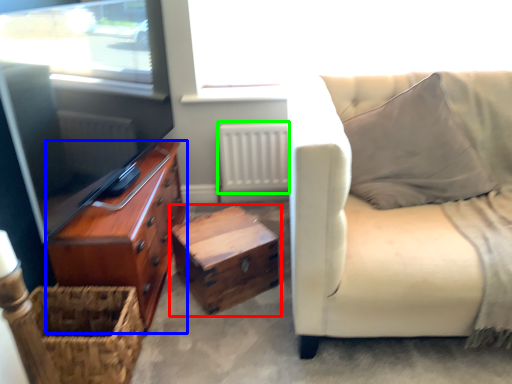
Question: Which object is positioned closest to table (highlighted by a red box)? Select from chest of drawers (highlighted by a blue box) and radiator (highlighted by a green box).

Choices:
 (A) chest of drawers
 (B) radiator

Answer: (A)